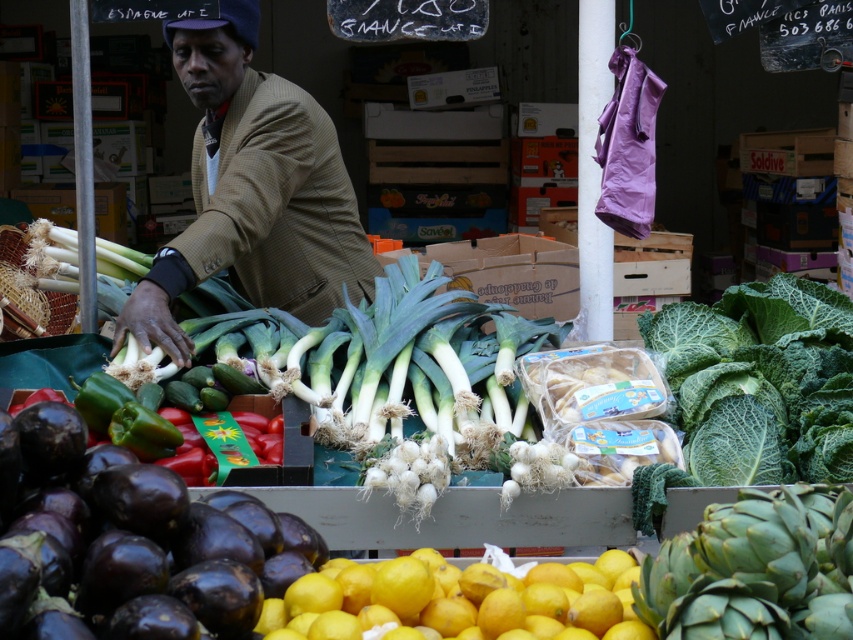
From the picture: You are a customer at the market who wants to pick up both the brown woolen jacket at center and the green leafy artichoke at lower right. If you can carry items within a 6 feet reach, can you grab both items without moving your position?

The brown woolen jacket at center and green leafy artichoke at lower right are 7.00 feet apart, which is beyond your 6 feet reach. You cannot grab both items without moving your position.

You are a customer at the market and want to buy the yellow matte lemons at lower center. You see the brown woolen jacket at center in your way. Which direction should you move to reach the lemons?

The brown woolen jacket at center is to the left of yellow matte lemons at lower center. So you should move to the right to reach the lemons.